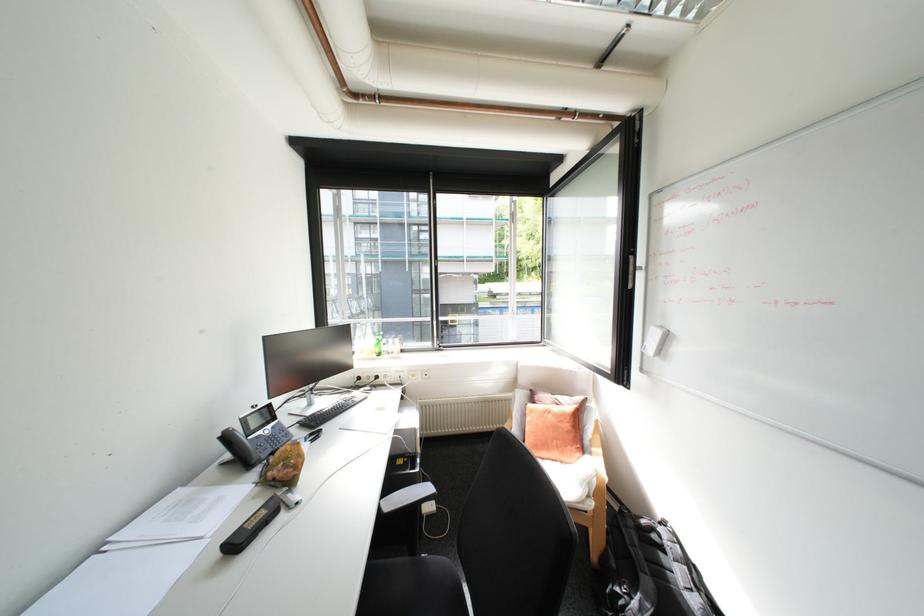
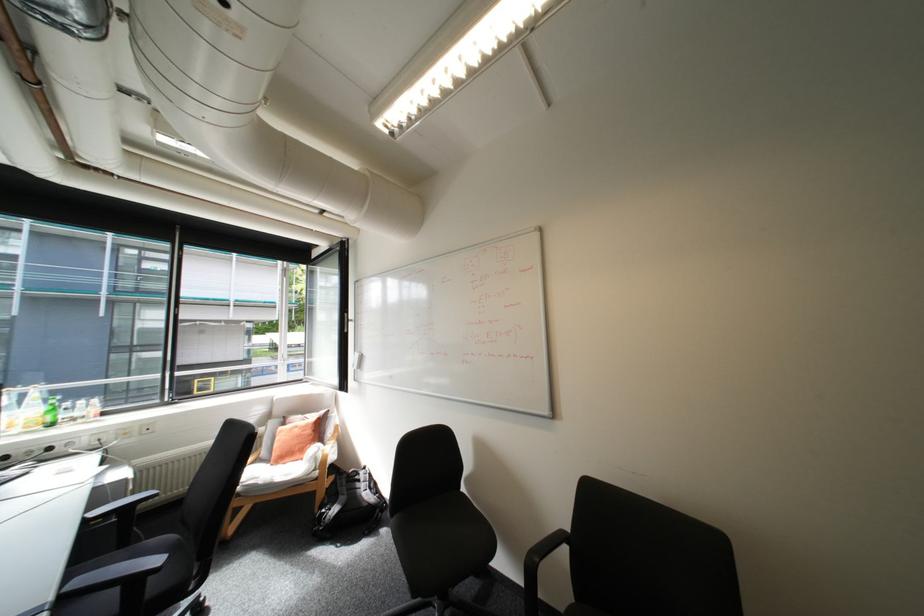
The point at (561,416) is marked in the first image. Where is the corresponding point in the second image?

(307, 429)